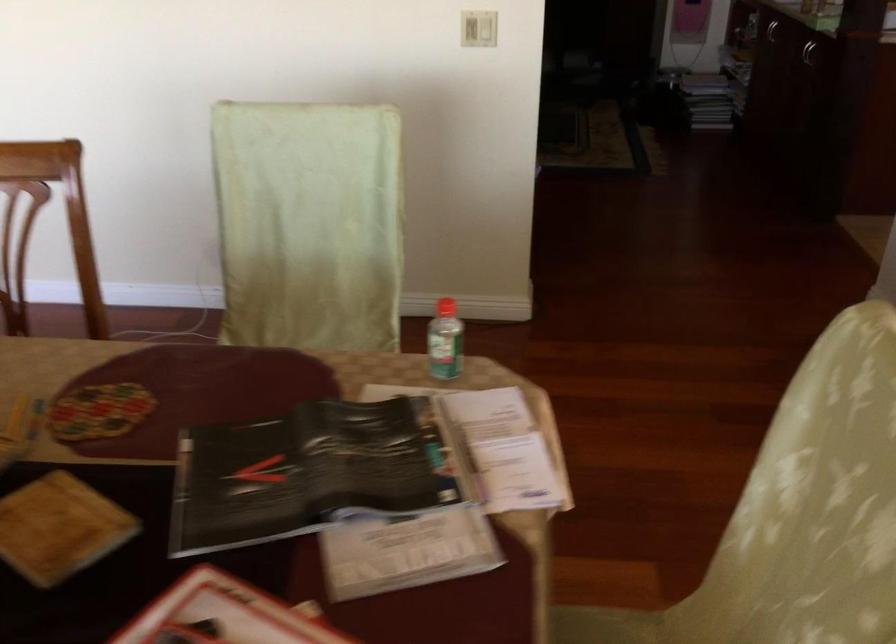
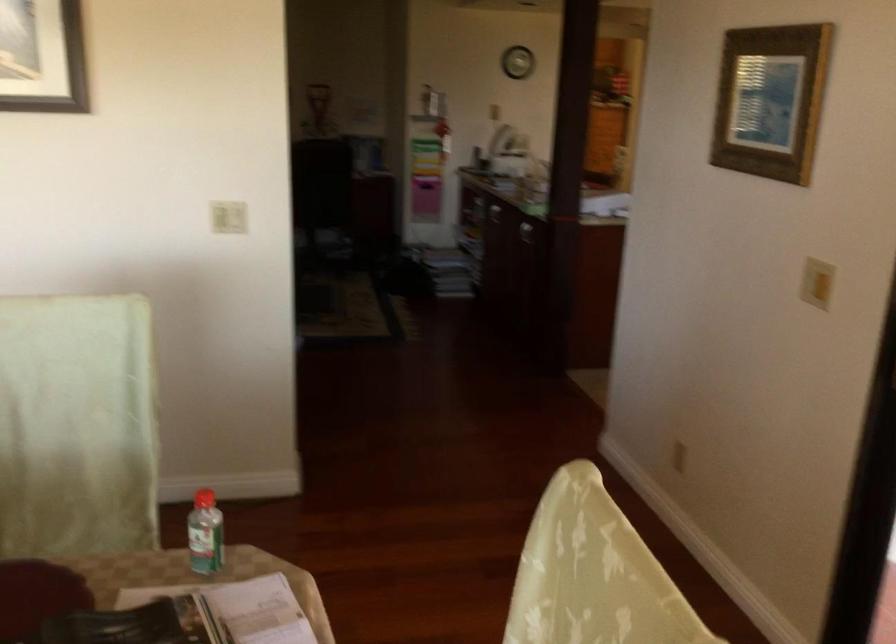
Find the pixel in the second image that matches point (444, 335) in the first image.

(204, 534)